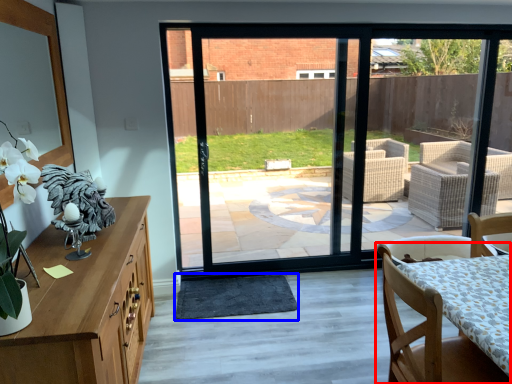
Question: Which of the following is the farthest to the observer, chair (highlighted by a red box) or wide (highlighted by a blue box)?

Choices:
 (A) chair
 (B) wide

Answer: (B)